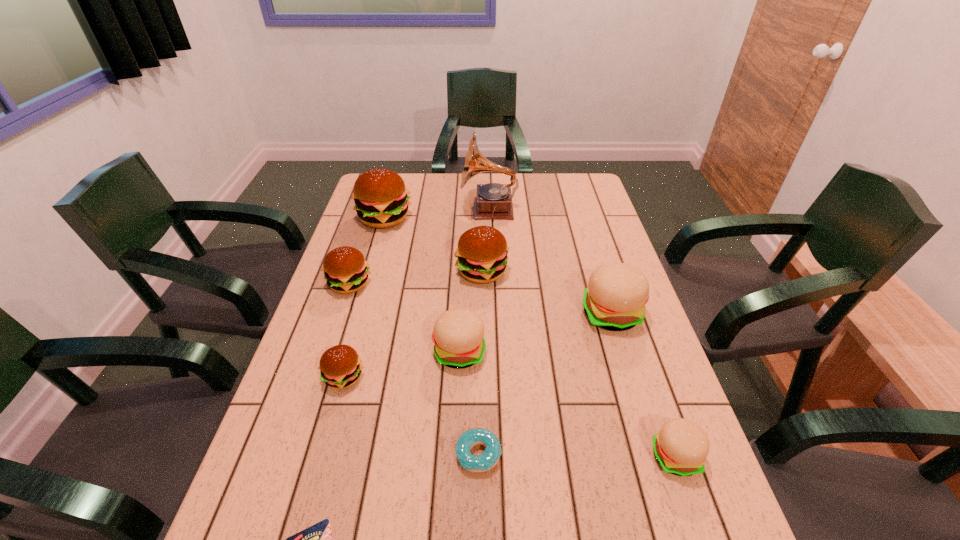
Select which beige hamburger appears as the third closest to the doughnut. Please provide its 2D coordinates. Your answer should be formatted as a tuple, i.e. [(x, y)], where the tuple contains the x and y coordinates of a point satisfying the conditions above.

[(615, 298)]

Identify which beige hamburger is located as the second nearest to the phonograph_record. Please provide its 2D coordinates. Your answer should be formatted as a tuple, i.e. [(x, y)], where the tuple contains the x and y coordinates of a point satisfying the conditions above.

[(458, 336)]

At what (x,y) coordinates should I click in order to perform the action: click on vacant space that satisfies the following two spatial constraints: 1. on the front side of the nearest beige hamburger; 2. on the left side of the biggest brown hamburger. Please return your answer as a coordinate pair (x, y). The image size is (960, 540). Looking at the image, I should click on (x=314, y=456).